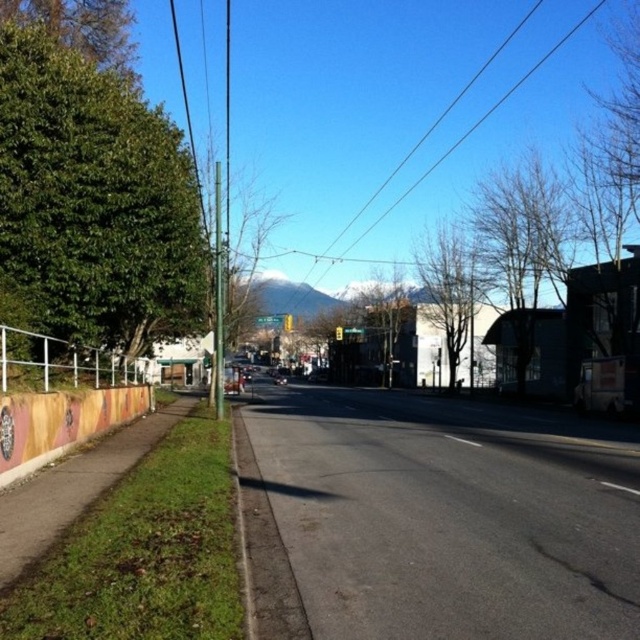
You are a painter who wants to draw the scene accurately. When comparing the white metal fence at lower left and the black wire at upper center, which one should you depict as thinner in your painting?

The white metal fence at lower left is thinner than the black wire at upper center, so you should depict the white metal fence at lower left as thinner in your painting.

You are a painter standing on the sidewalk and want to paint the white metal fence at lower left and the black wire at upper center. Which object is closer to the ground?

The white metal fence at lower left is shorter than the black wire at upper center, so it is closer to the ground.

You are standing on the sidewalk looking straight ahead. Which object is positioned to the left of the other between the white metal fence at lower left and the black wire at upper center?

The white metal fence at lower left is positioned to the left of the black wire at upper center.